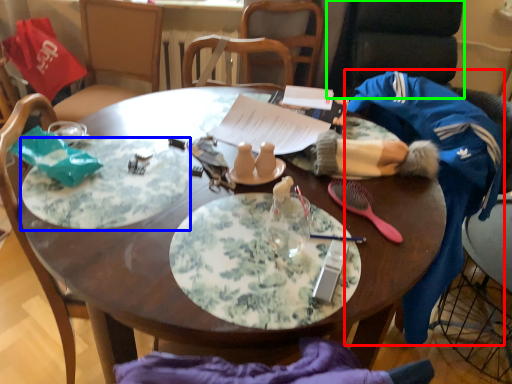
Question: Which object is positioned farthest from clothing (highlighted by a red box)? Select from platter (highlighted by a blue box) and armchair (highlighted by a green box).

Choices:
 (A) platter
 (B) armchair

Answer: (B)